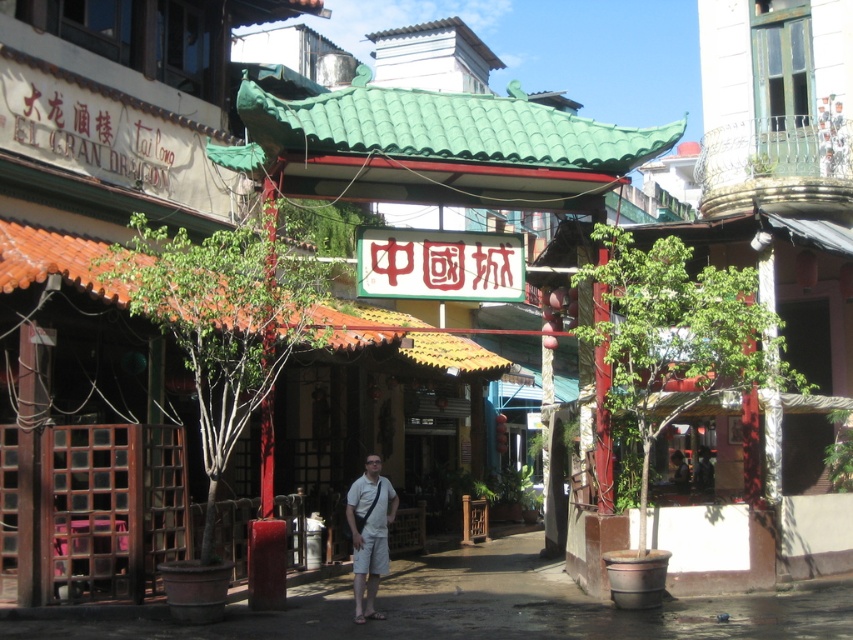
You are standing in the Chinatown street scene. There is a point marked at coordinates (437, 147). Based on the scene description, can you determine what this point is located on?

The point at coordinates (437, 147) is located on the green tile canopy at center.

You are a delivery person who needs to deliver a package to the building with the sign El Gran Dragon. You are standing at the entrance of the alleyway under the red and green gate. The package is too tall to carry while bending. Which object between the green tile canopy at center and the dark gray fabric pants at lower center should you avoid hitting your head on?

The green tile canopy at center has a greater height compared to dark gray fabric pants at lower center. Therefore, you should avoid hitting your head on the dark gray fabric pants at lower center since it is lower.